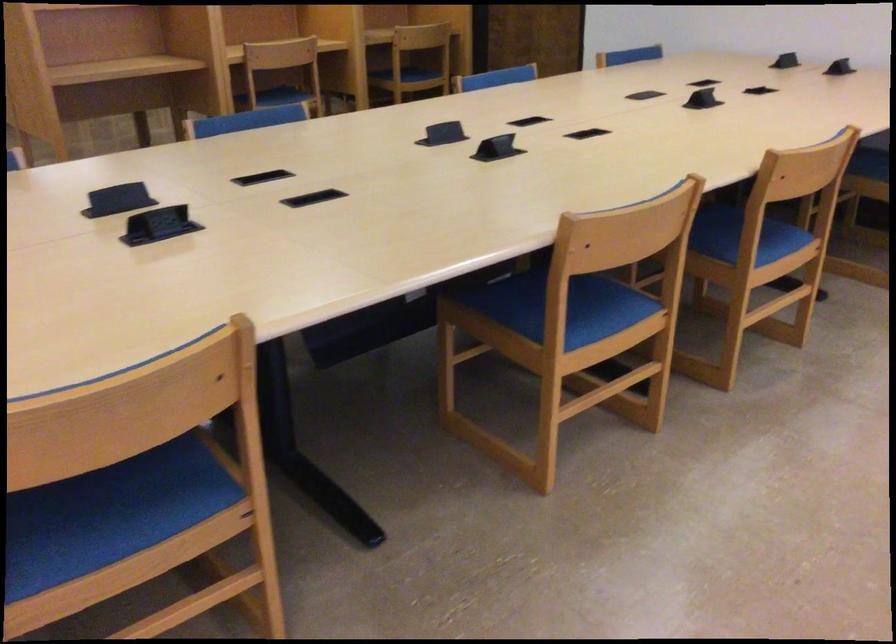
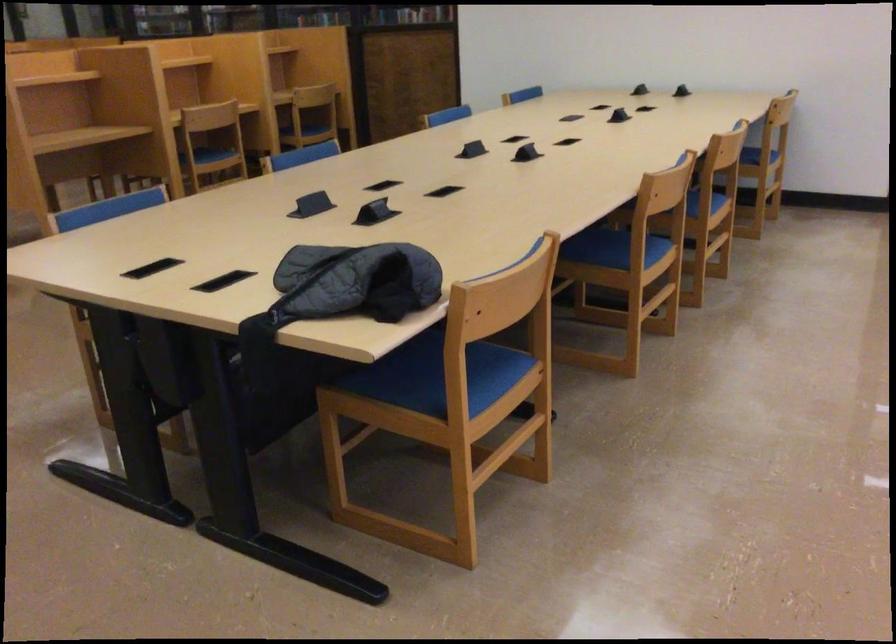
The point at (x=741, y=257) is marked in the first image. Where is the corresponding point in the second image?

(702, 207)